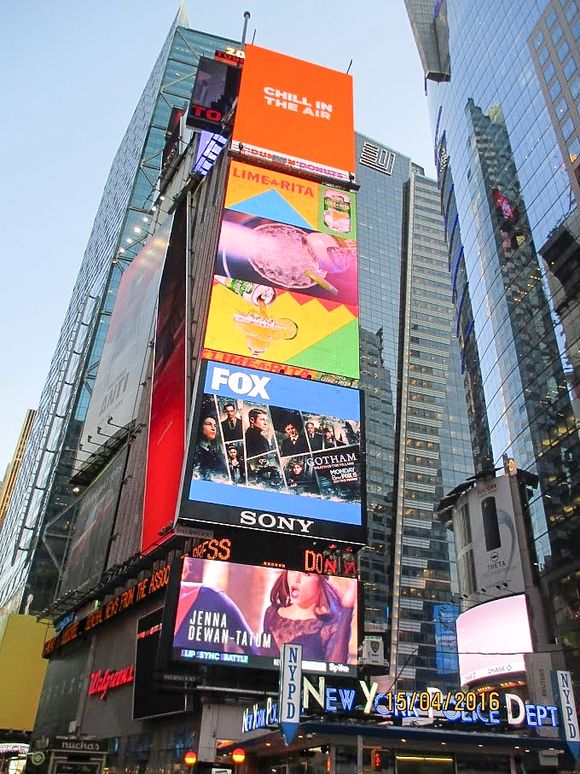
I want to click on windows, so click(x=500, y=60), click(x=523, y=138), click(x=552, y=46), click(x=143, y=122), click(x=387, y=217).